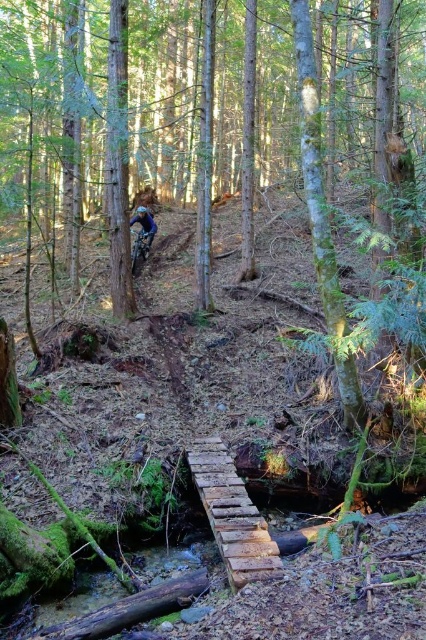
Based on the photo, is rustic wooden bridge at center positioned before blue fabric helmet at upper center?

Yes, rustic wooden bridge at center is closer to the viewer.

Is rustic wooden bridge at center thinner than blue fabric helmet at upper center?

No, rustic wooden bridge at center is not thinner than blue fabric helmet at upper center.

Identify the location of rustic wooden bridge at center. This screenshot has height=640, width=426. (233, 515).

Which of these two, shiny metallic mountain bike at center or blue fabric helmet at upper center, stands shorter?

shiny metallic mountain bike at center is shorter.

In the scene shown: Does shiny metallic mountain bike at center have a lesser height compared to blue fabric helmet at upper center?

Correct, shiny metallic mountain bike at center is not as tall as blue fabric helmet at upper center.

This screenshot has height=640, width=426. I want to click on shiny metallic mountain bike at center, so click(x=140, y=248).

Locate an element on the screen. shiny metallic mountain bike at center is located at coordinates point(140,248).

Between rustic wooden bridge at center and shiny metallic mountain bike at center, which one is positioned higher?

shiny metallic mountain bike at center

Which of these two, rustic wooden bridge at center or shiny metallic mountain bike at center, stands taller?

Standing taller between the two is shiny metallic mountain bike at center.

What do you see at coordinates (233, 515) in the screenshot?
I see `rustic wooden bridge at center` at bounding box center [233, 515].

Locate an element on the screen. This screenshot has width=426, height=640. rustic wooden bridge at center is located at coordinates (233, 515).